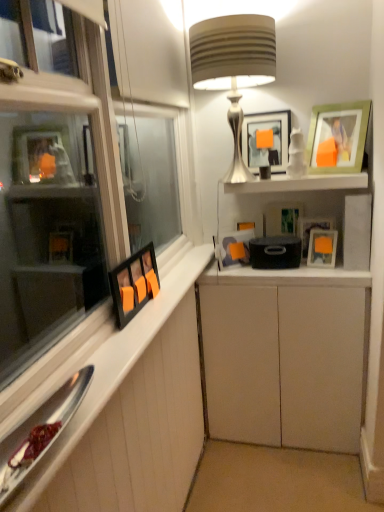
Where is `blank space situated above white wood cabinet at left, placed as the 1th cabinetry when sorted from left to right (from a real-world perspective)`? The height and width of the screenshot is (512, 384). blank space situated above white wood cabinet at left, placed as the 1th cabinetry when sorted from left to right (from a real-world perspective) is located at coordinates (116, 324).